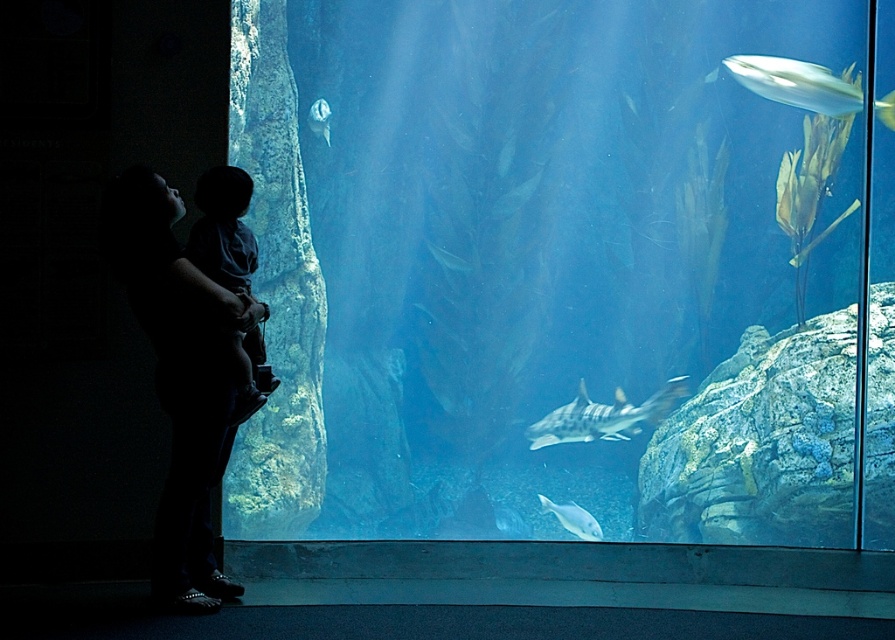
You are a marine biologist observing the aquarium. You notice the shiny silver fish at upper right and the speckled gray shark at center. Which one is wider?

The shiny silver fish at upper right is narrower than the speckled gray shark at center, so the speckled gray shark at center is wider.

You are standing in front of the aquarium and notice two points marked on the glass. The first point is at coordinates point (x=257, y=387) and the second at point (x=321, y=125). Which point is closer to you?

Point (x=257, y=387) is in front of point (x=321, y=125), so the first point is closer to you.

You are a visitor at the aquarium. You see the dark blue fabric at left and the shiny silver fish at upper right. Which object is taller?

The dark blue fabric at left is taller than the shiny silver fish at upper right.